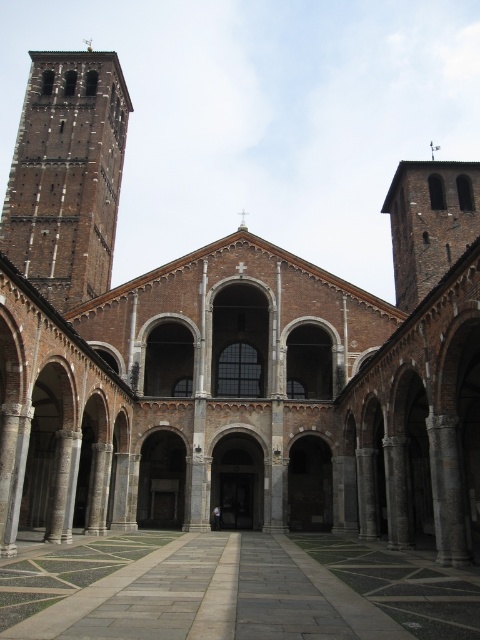
You are an architect designing a new pathway in the courtyard. The pathway needs to be as wide as the brick tower at upper left. Can the pathway fit across the smooth stone floor at center without exceeding its width?

The smooth stone floor at center is wider than the brick tower at upper left. Therefore, a pathway as wide as the brick tower at upper left can fit across the smooth stone floor at center without exceeding its width.

You are standing in the courtyard of the historic building. You notice two points marked in the scene. The first point is at coordinates point (14, 586) and the second is at point (84, 209). Which point is closer to you?

Point (14, 586) is in front of point (84, 209), so it is closer to you.

You are an architect planning to install a new sculpture in the courtyard. The sculpture requires a base that must be larger than the smooth stone floor at center. Can the brick tower at upper left accommodate this base?

The smooth stone floor at center is smaller than the brick tower at upper left. Therefore, the brick tower at upper left can accommodate the base since it is larger than the smooth stone floor at center.